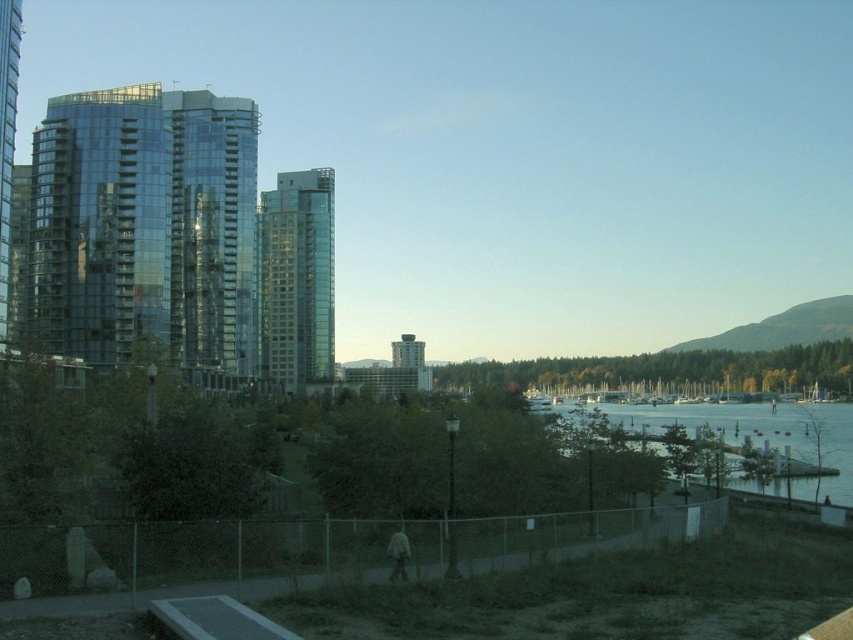
Does clear water at lower right have a smaller size compared to matte gray tower at center?

No.

Can you confirm if clear water at lower right is positioned to the left of matte gray tower at center?

In fact, clear water at lower right is to the right of matte gray tower at center.

Is point (735, 438) farther from camera compared to point (399, 339)?

No.

Where is `clear water at lower right`? The image size is (853, 640). clear water at lower right is located at coordinates (763, 438).

Is shiny glass building at left below glassy reflective building at center?

Correct, shiny glass building at left is located below glassy reflective building at center.

Is point (206, 308) farther from viewer compared to point (328, 369)?

No, (206, 308) is closer to viewer.

At what (x,y) coordinates should I click in order to perform the action: click on shiny glass building at left. Please return your answer as a coordinate pair (x, y). The image size is (853, 640). Looking at the image, I should click on (148, 228).

In the scene shown: Between shiny glass building at left and clear water at lower right, which one is positioned higher?

shiny glass building at left is above.

Can you confirm if shiny glass building at left is bigger than clear water at lower right?

Actually, shiny glass building at left might be smaller than clear water at lower right.

Between point (238, 122) and point (728, 406), which one is positioned in front?

Positioned in front is point (238, 122).

Where is `shiny glass building at left`? shiny glass building at left is located at coordinates (148, 228).